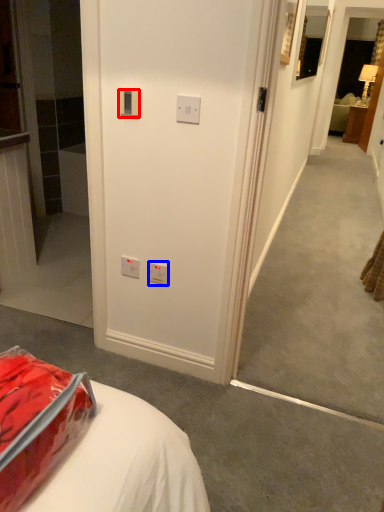
Question: Which of the following is the closest to the observer, electric outlet (highlighted by a red box) or electric outlet (highlighted by a blue box)?

Choices:
 (A) electric outlet
 (B) electric outlet

Answer: (A)